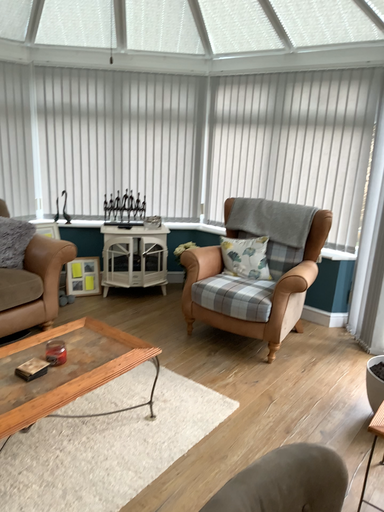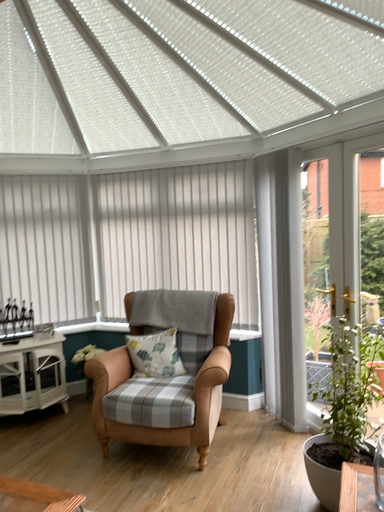
Question: Which way did the camera rotate in the video?

Choices:
 (A) rotated upward
 (B) rotated downward

Answer: (A)